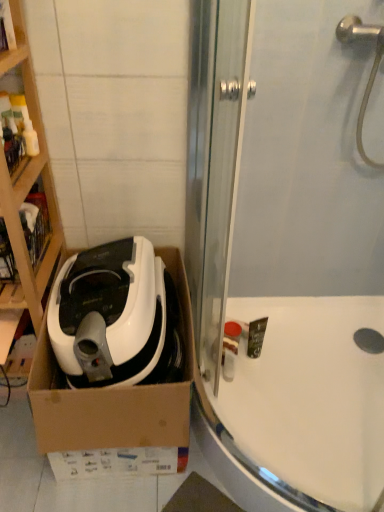
Question: In which direction should I rotate to look at transparent glass shower door at upper center?

Choices:
 (A) left
 (B) right

Answer: (B)

Question: Can you confirm if white glossy bathtub at lower right is shorter than transparent glass shower door at upper center?

Choices:
 (A) yes
 (B) no

Answer: (A)

Question: Is white glossy bathtub at lower right closer to the viewer compared to transparent glass shower door at upper center?

Choices:
 (A) yes
 (B) no

Answer: (B)

Question: Considering the relative sizes of white glossy bathtub at lower right and transparent glass shower door at upper center in the image provided, is white glossy bathtub at lower right smaller than transparent glass shower door at upper center?

Choices:
 (A) no
 (B) yes

Answer: (A)

Question: Can you confirm if white glossy bathtub at lower right is wider than transparent glass shower door at upper center?

Choices:
 (A) yes
 (B) no

Answer: (A)

Question: Considering the relative sizes of white glossy bathtub at lower right and transparent glass shower door at upper center in the image provided, is white glossy bathtub at lower right thinner than transparent glass shower door at upper center?

Choices:
 (A) yes
 (B) no

Answer: (B)

Question: Is white glossy bathtub at lower right bigger than transparent glass shower door at upper center?

Choices:
 (A) no
 (B) yes

Answer: (B)

Question: Can you confirm if white cardboard box at left is wider than white glossy bathtub at lower right?

Choices:
 (A) yes
 (B) no

Answer: (B)

Question: From a real-world perspective, is white cardboard box at left located higher than white glossy bathtub at lower right?

Choices:
 (A) no
 (B) yes

Answer: (B)

Question: Is white cardboard box at left with white glossy bathtub at lower right?

Choices:
 (A) yes
 (B) no

Answer: (B)

Question: From a real-world perspective, is white cardboard box at left beneath white glossy bathtub at lower right?

Choices:
 (A) yes
 (B) no

Answer: (B)

Question: Is white cardboard box at left outside of white glossy bathtub at lower right?

Choices:
 (A) yes
 (B) no

Answer: (A)

Question: From the image's perspective, is white cardboard box at left located beneath white glossy bathtub at lower right?

Choices:
 (A) yes
 (B) no

Answer: (B)

Question: From a real-world perspective, is white glossy bathtub at lower right below white cardboard box at left?

Choices:
 (A) no
 (B) yes

Answer: (B)